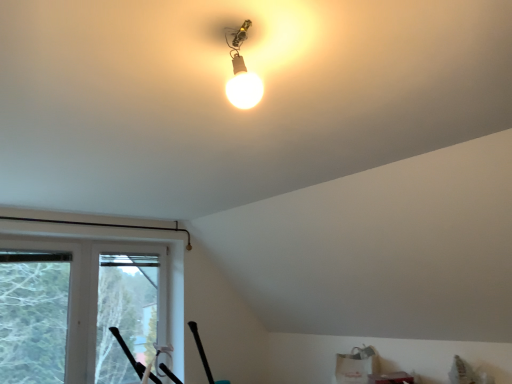
Question: Looking at their shapes, would you say matte glass bulb at upper center is wider or thinner than transparent plastic window screen at left, which is the 2th window screen from right to left?

Choices:
 (A) thin
 (B) wide

Answer: (B)

Question: Is point (238, 34) closer or farther from the camera than point (7, 276)?

Choices:
 (A) farther
 (B) closer

Answer: (B)

Question: Which of these objects is positioned closest to the matte glass bulb at upper center?

Choices:
 (A) transparent plastic window screen at lower left, which appears as the first window screen when viewed from the right
 (B) transparent plastic window screen at left, which is the 2th window screen from right to left

Answer: (B)

Question: Which of these objects is positioned closest to the transparent plastic window screen at lower left, which appears as the second window screen when viewed from the left?

Choices:
 (A) matte glass bulb at upper center
 (B) transparent plastic window screen at left, which is the 2th window screen from right to left

Answer: (B)